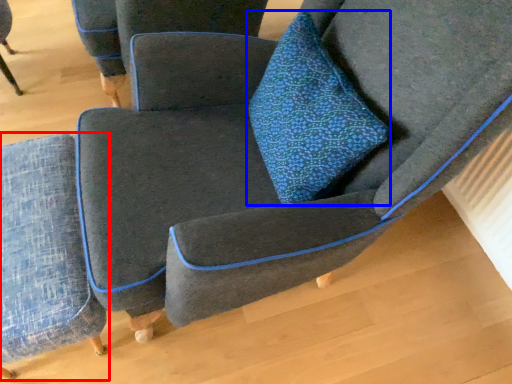
Question: Which object is further to the camera taking this photo, chair (highlighted by a red box) or throw pillow (highlighted by a blue box)?

Choices:
 (A) chair
 (B) throw pillow

Answer: (A)